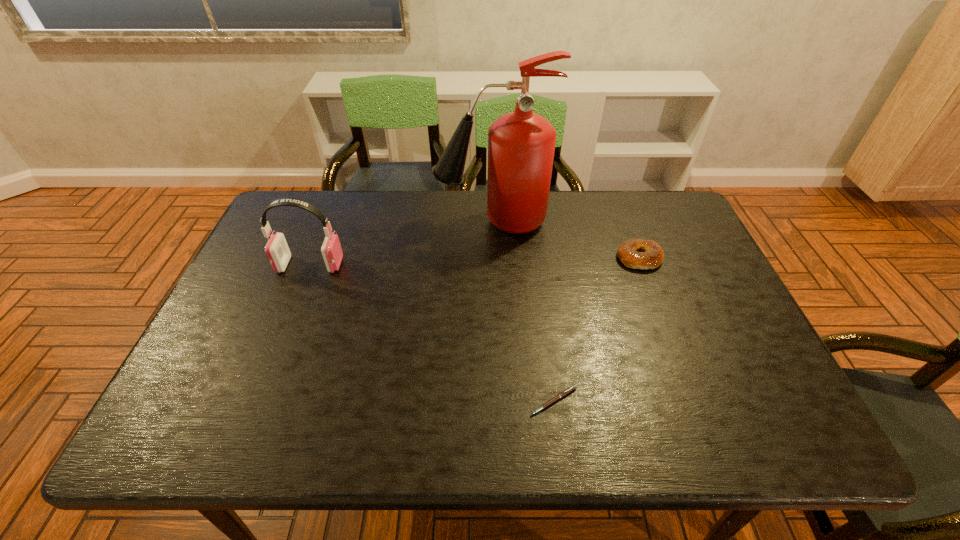
Where is `free space located with the nozzle aimed from the tallest object`? This screenshot has width=960, height=540. free space located with the nozzle aimed from the tallest object is located at coordinates tap(379, 221).

This screenshot has height=540, width=960. I want to click on free space located 0.330m on the outer surface of the second tallest object, so click(x=456, y=265).

The width and height of the screenshot is (960, 540). I want to click on vacant position located 0.370m on the front of the bagel, so click(x=689, y=389).

What are the coordinates of `object present at the far edge` in the screenshot? It's located at (521, 144).

At what (x,y) coordinates should I click in order to perform the action: click on object that is at the near edge. Please return your answer as a coordinate pair (x, y). The height and width of the screenshot is (540, 960). Looking at the image, I should click on (572, 388).

This screenshot has height=540, width=960. Find the location of `object that is positioned at the left edge`. object that is positioned at the left edge is located at coordinates (278, 253).

Find the location of a particular element. object situated at the right edge is located at coordinates (652, 256).

The image size is (960, 540). Find the location of `vacant area at the far edge`. vacant area at the far edge is located at coordinates (551, 231).

Locate an element on the screen. This screenshot has width=960, height=540. free space at the near edge of the desktop is located at coordinates (697, 442).

Find the location of `free space at the left edge of the desktop`. free space at the left edge of the desktop is located at coordinates (261, 291).